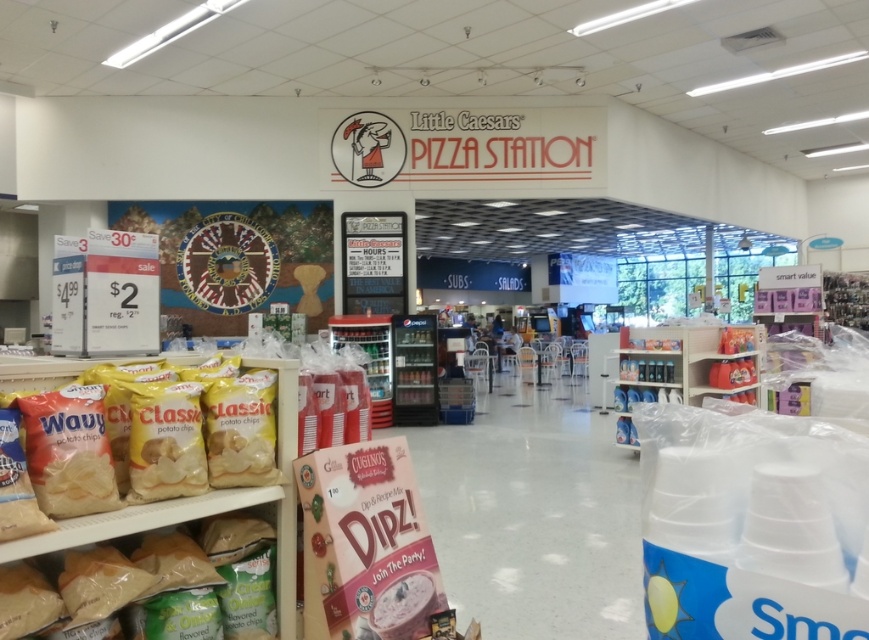
Is point (201, 556) more distant than point (83, 531)?

Yes, it is behind point (83, 531).

Describe the element at coordinates (127, 573) in the screenshot. I see `translucent plastic bag of chips at lower left` at that location.

Locate an element on the screen. The height and width of the screenshot is (640, 869). translucent plastic bag of chips at lower left is located at coordinates (127, 573).